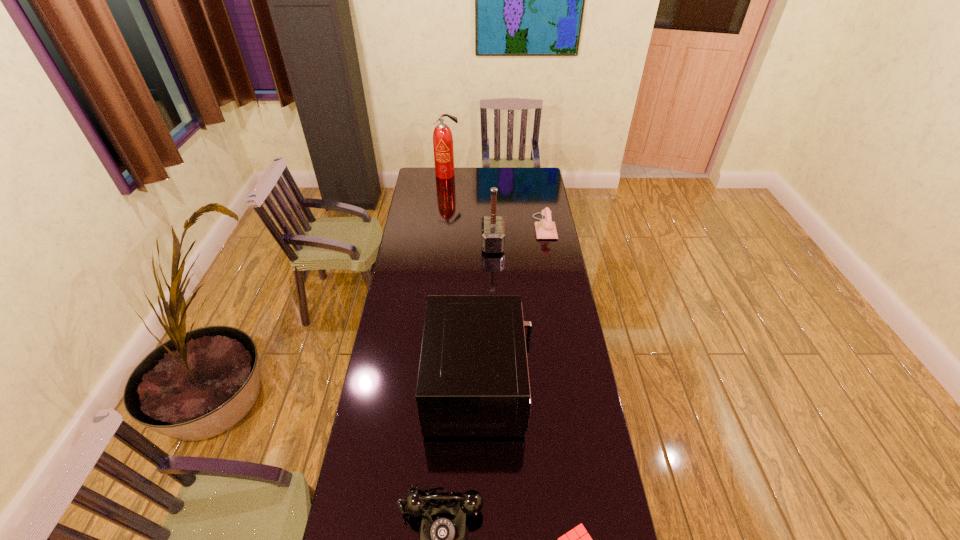
This screenshot has height=540, width=960. What are the coordinates of `fire extinguisher` in the screenshot? It's located at (442, 136).

Image resolution: width=960 pixels, height=540 pixels. I want to click on hammer, so click(493, 229).

Where is `microwave_oven`? microwave_oven is located at coordinates (473, 380).

What are the coordinates of `the fourth shortest object` in the screenshot? It's located at (473, 380).

Where is `the right telephone`? the right telephone is located at coordinates tap(545, 229).

Identify the location of free point located 0.300m on the right of the fire extinguisher. (508, 175).

You are a GUI agent. You are given a task and a screenshot of the screen. Output one action in this format:
    pyautogui.click(x=<x>, y=<y>)
    Task: Click on the vacant area located on the right of the hammer
    The height and width of the screenshot is (540, 960).
    Given the screenshot: What is the action you would take?
    pyautogui.click(x=549, y=244)

At what (x,y) coordinates should I click in order to perform the action: click on free space located on the front-facing side of the fourth shortest object. Please return your answer as a coordinate pair (x, y). Looking at the image, I should click on (567, 385).

You are a GUI agent. You are given a task and a screenshot of the screen. Output one action in this format:
    pyautogui.click(x=<x>, y=<y>)
    Task: Click on the free space located 0.310m on the dial of the farther telephone
    The height and width of the screenshot is (540, 960).
    Given the screenshot: What is the action you would take?
    pyautogui.click(x=476, y=227)

Identify the location of vacant space situated on the dial of the farther telephone. (521, 227).